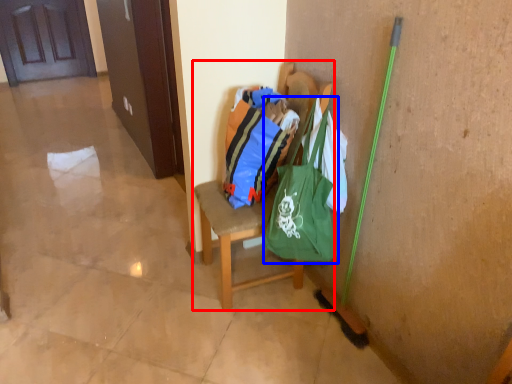
Question: Which object is further to the camera taking this photo, chair (highlighted by a red box) or shoulder bag (highlighted by a blue box)?

Choices:
 (A) chair
 (B) shoulder bag

Answer: (A)